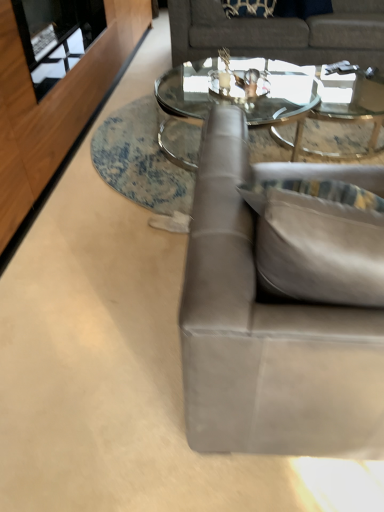
Question: Can you confirm if gray fabric couch at upper center, acting as the second studio couch starting from the bottom, is shorter than suede gray couch at right, acting as the first studio couch starting from the front?

Choices:
 (A) yes
 (B) no

Answer: (A)

Question: Does gray fabric couch at upper center, placed as the 2th studio couch when sorted from front to back, lie behind suede gray couch at right, acting as the first studio couch starting from the front?

Choices:
 (A) no
 (B) yes

Answer: (B)

Question: Are gray fabric couch at upper center, the 1th studio couch when ordered from back to front, and suede gray couch at right, placed as the first studio couch when sorted from bottom to top, far apart?

Choices:
 (A) no
 (B) yes

Answer: (B)

Question: Is gray fabric couch at upper center, the 1th studio couch when ordered from back to front, beside suede gray couch at right, which appears as the second studio couch when viewed from the back?

Choices:
 (A) yes
 (B) no

Answer: (B)

Question: Does gray fabric couch at upper center, the 1th studio couch when ordered from back to front, have a larger size compared to suede gray couch at right, acting as the first studio couch starting from the front?

Choices:
 (A) no
 (B) yes

Answer: (B)

Question: From a real-world perspective, is clear glass coffee table at center physically located above or below suede gray couch at right, which appears as the second studio couch when viewed from the back?

Choices:
 (A) above
 (B) below

Answer: (B)

Question: In the image, is clear glass coffee table at center positioned in front of or behind suede gray couch at right, placed as the first studio couch when sorted from bottom to top?

Choices:
 (A) front
 (B) behind

Answer: (B)

Question: Is point (286, 138) closer or farther from the camera than point (307, 443)?

Choices:
 (A) farther
 (B) closer

Answer: (A)

Question: Considering the relative positions of clear glass coffee table at center and suede gray couch at right, the 2th studio couch in the top-to-bottom sequence, in the image provided, is clear glass coffee table at center to the left or to the right of suede gray couch at right, the 2th studio couch in the top-to-bottom sequence,?

Choices:
 (A) right
 (B) left

Answer: (A)

Question: From a real-world perspective, is gray fabric couch at upper center, the 1th studio couch when ordered from back to front, physically located above or below suede gray couch at right, placed as the first studio couch when sorted from bottom to top?

Choices:
 (A) above
 (B) below

Answer: (B)

Question: Does point (208, 28) appear closer or farther from the camera than point (188, 303)?

Choices:
 (A) closer
 (B) farther

Answer: (B)

Question: From the image's perspective, is gray fabric couch at upper center, the 1th studio couch when ordered from back to front, positioned above or below suede gray couch at right, which appears as the second studio couch when viewed from the back?

Choices:
 (A) above
 (B) below

Answer: (A)

Question: Based on their sizes in the image, would you say gray fabric couch at upper center, the 1th studio couch when ordered from back to front, is bigger or smaller than suede gray couch at right, the 2th studio couch in the top-to-bottom sequence?

Choices:
 (A) big
 (B) small

Answer: (A)

Question: Is transparent glass door at upper left in front of or behind gray fabric couch at upper center, placed as the 2th studio couch when sorted from front to back, in the image?

Choices:
 (A) front
 (B) behind

Answer: (A)

Question: Is transparent glass door at upper left to the left or to the right of gray fabric couch at upper center, placed as the 2th studio couch when sorted from front to back, in the image?

Choices:
 (A) left
 (B) right

Answer: (A)